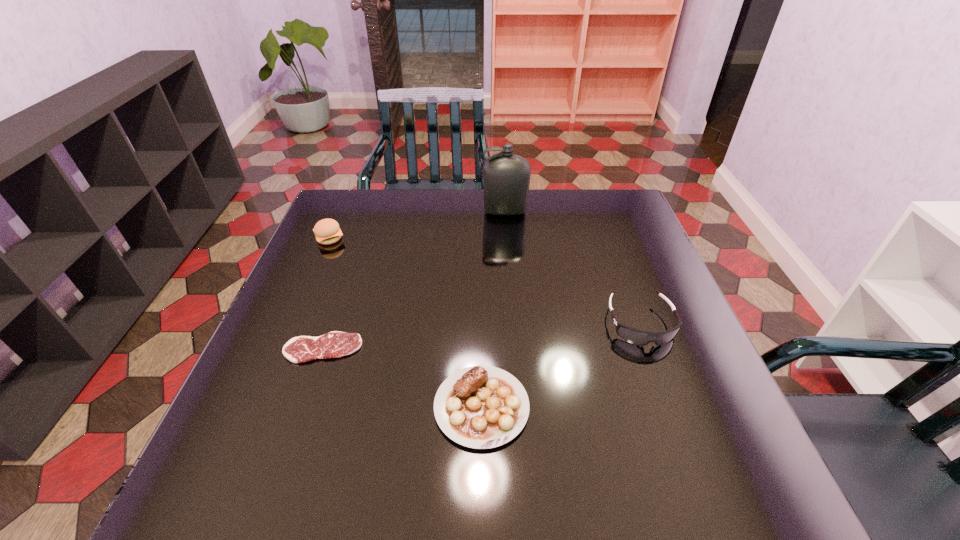
I want to click on bottle, so click(506, 177).

The image size is (960, 540). Find the location of `the tallest object`. the tallest object is located at coordinates (506, 177).

Locate an element on the screen. This screenshot has height=540, width=960. hamburger is located at coordinates (327, 231).

Locate an element on the screen. The width and height of the screenshot is (960, 540). the third shortest object is located at coordinates (638, 337).

I want to click on goggles, so click(x=638, y=337).

At what (x,y) coordinates should I click in order to perform the action: click on the fourth tallest object. Please return your answer as a coordinate pair (x, y). Looking at the image, I should click on (481, 407).

At what (x,y) coordinates should I click in order to perform the action: click on the taller steak. Please return your answer as a coordinate pair (x, y). The width and height of the screenshot is (960, 540). Looking at the image, I should click on (481, 407).

Image resolution: width=960 pixels, height=540 pixels. I want to click on the shorter steak, so click(x=335, y=344).

Where is `the left steak`? This screenshot has height=540, width=960. the left steak is located at coordinates pos(335,344).

Identify the location of free space located on the front of the farthest object. coord(510,268).